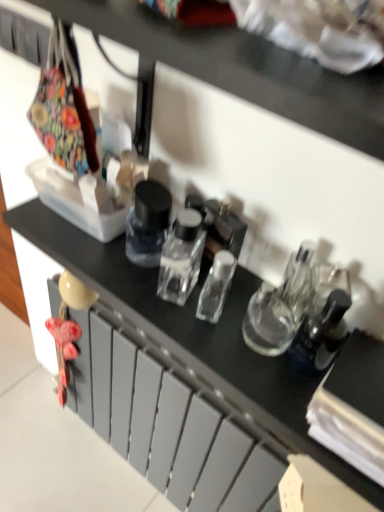
Question: Can you confirm if transparent glass bottle at center is taller than matte gray drawer at center?

Choices:
 (A) yes
 (B) no

Answer: (B)

Question: Does transparent glass bottle at center have a lesser height compared to matte gray drawer at center?

Choices:
 (A) yes
 (B) no

Answer: (A)

Question: From the image's perspective, does transparent glass bottle at center appear higher than matte gray drawer at center?

Choices:
 (A) yes
 (B) no

Answer: (A)

Question: Can you confirm if transparent glass bottle at center is smaller than matte gray drawer at center?

Choices:
 (A) yes
 (B) no

Answer: (A)

Question: Is transparent glass bottle at center to the left of matte gray drawer at center from the viewer's perspective?

Choices:
 (A) no
 (B) yes

Answer: (A)

Question: Is transparent glass bottle at center thinner than matte gray drawer at center?

Choices:
 (A) yes
 (B) no

Answer: (A)

Question: Is matte gray drawer at center at the left side of transparent glass bottle at center?

Choices:
 (A) yes
 (B) no

Answer: (A)

Question: Is transparent glass bottle at center inside matte gray drawer at center?

Choices:
 (A) no
 (B) yes

Answer: (A)

Question: Does matte gray drawer at center have a lesser width compared to transparent glass bottle at center?

Choices:
 (A) yes
 (B) no

Answer: (B)

Question: Is matte gray drawer at center to the right of transparent glass bottle at center from the viewer's perspective?

Choices:
 (A) no
 (B) yes

Answer: (A)

Question: From a real-world perspective, is matte gray drawer at center physically above transparent glass bottle at center?

Choices:
 (A) no
 (B) yes

Answer: (A)

Question: Is matte gray drawer at center wider than transparent glass bottle at center?

Choices:
 (A) no
 (B) yes

Answer: (B)

Question: Does point (152, 370) appear closer or farther from the camera than point (246, 309)?

Choices:
 (A) closer
 (B) farther

Answer: (B)